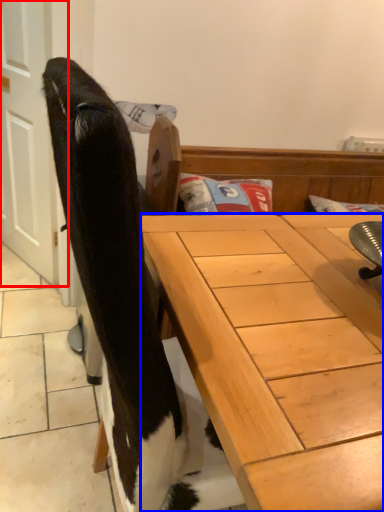
Question: Which object appears farthest to the camera in this image, screen door (highlighted by a red box) or desk (highlighted by a blue box)?

Choices:
 (A) screen door
 (B) desk

Answer: (A)